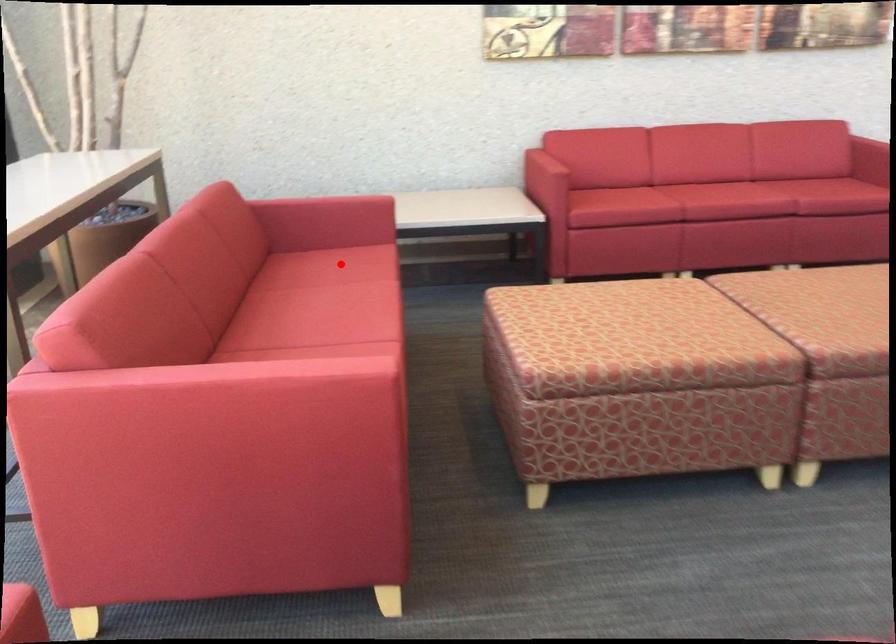
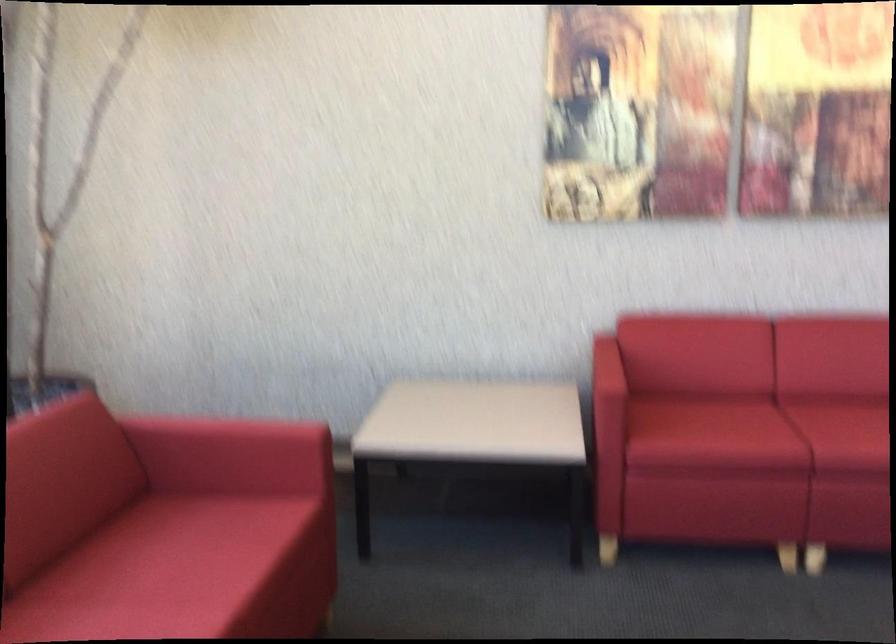
Where in the second image is the point corresponding to the highlighted location from the first image?

(195, 547)